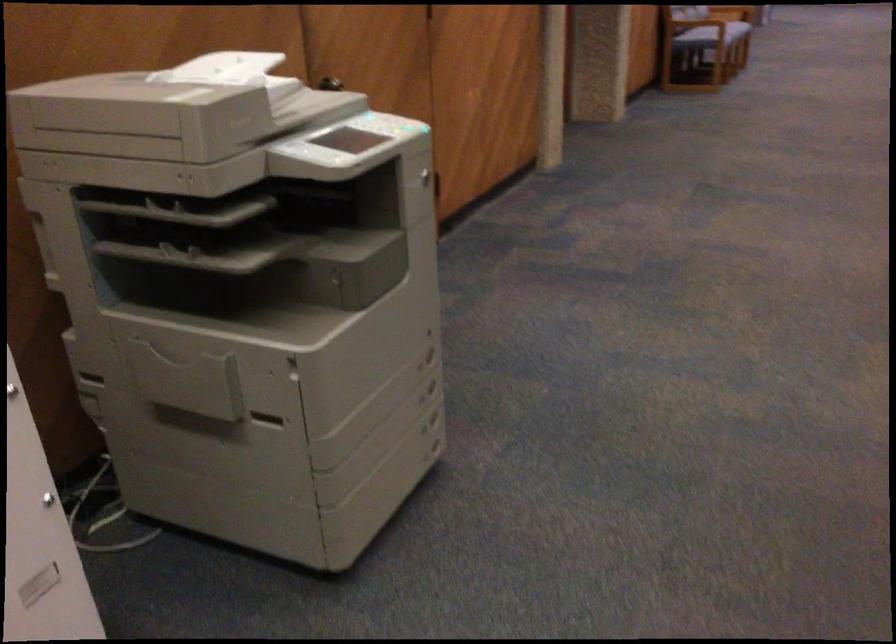
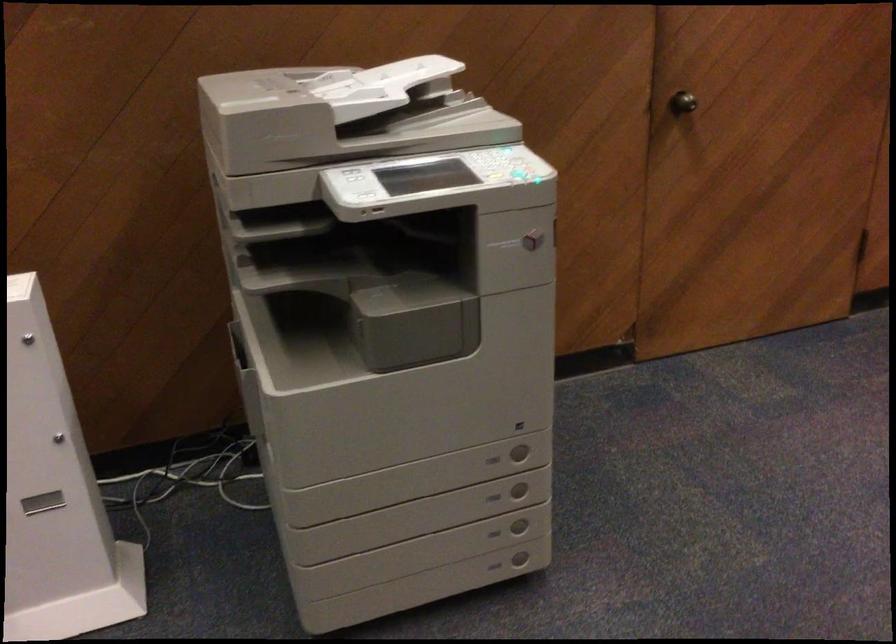
Question: I am providing you with two images of the same scene from different viewpoints. Please identify which objects are invisible in image2.

Choices:
 (A) document feeder tray
 (B) printer tray handle
 (C) printer access handle
 (D) none of these

Answer: (D)